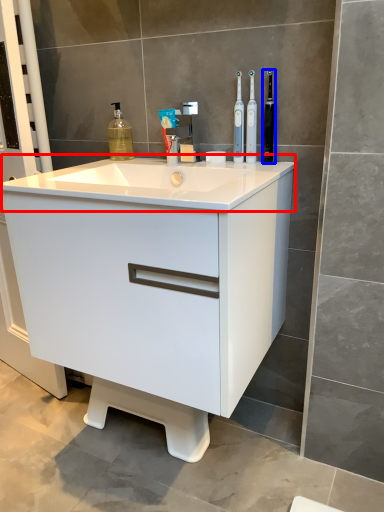
Question: Which point is further to the camera, counter top (highlighted by a red box) or toothbrush (highlighted by a blue box)?

Choices:
 (A) counter top
 (B) toothbrush

Answer: (B)